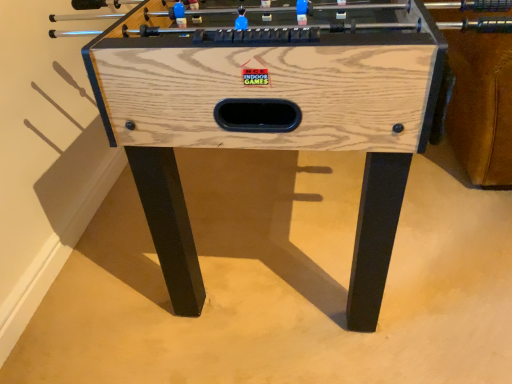
Describe the element at coordinates (271, 118) in the screenshot. I see `wooden foosball table at center` at that location.

Where is `wooden foosball table at center`? wooden foosball table at center is located at coordinates (271, 118).

The height and width of the screenshot is (384, 512). I want to click on wooden foosball table at center, so click(271, 118).